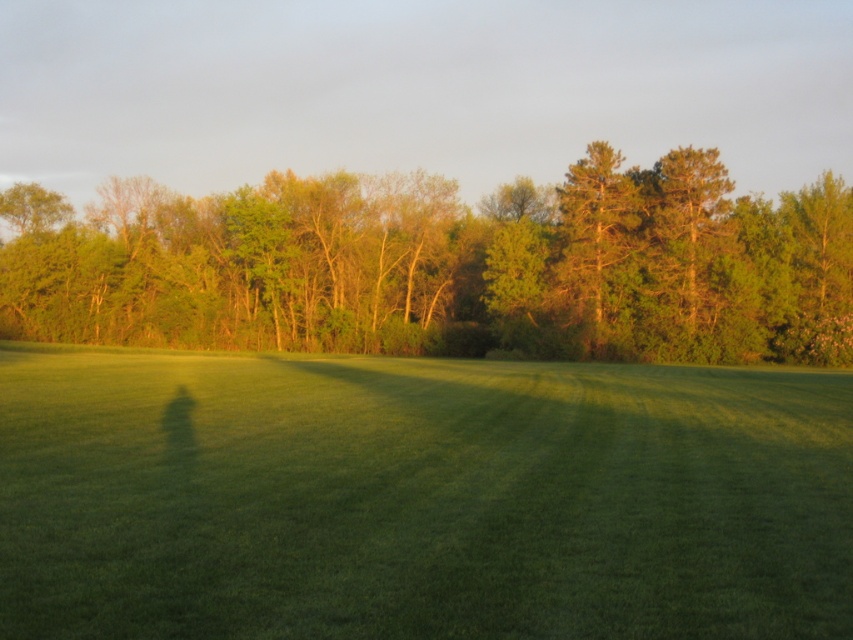
You are a gardener planning to mow the lawn. You notice the green grass at center and the green leafy forest at upper center. Which area is shorter in height?

The green grass at center is shorter in height compared to the green leafy forest at upper center.

You are planning to plant a new tree in this area. Considering the space available between the green leafy forest at upper center and the green textured tree at center, which one do you think requires more horizontal space for its growth?

The green leafy forest at upper center requires more horizontal space for its growth because its width is larger than the green textured tree at center.

You are standing on the green grass in the foreground and want to walk towards the green leafy forest at upper center. Based on the coordinates provided, in which general direction should you head?

The green leafy forest at upper center is located at coordinates approximately 0.416 on the x and 0.522 on the y. Since the forest is at upper center, you should head in a northerly direction to reach it.